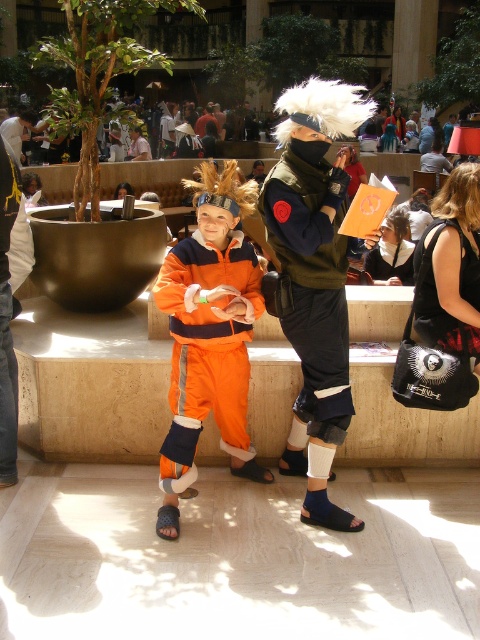
Does matte black vest at center appear on the right side of matte black mask at upper center?

Incorrect, matte black vest at center is not on the right side of matte black mask at upper center.

Is point (276, 225) closer to viewer compared to point (381, 138)?

Yes, it is in front of point (381, 138).

Locate an element on the screen. matte black vest at center is located at coordinates (314, 276).

Is matte black vest at center to the left of dark red fabric shirt at center from the viewer's perspective?

No, matte black vest at center is not to the left of dark red fabric shirt at center.

Does matte black vest at center lie in front of dark red fabric shirt at center?

Yes, matte black vest at center is in front of dark red fabric shirt at center.

Is point (305, 132) farther from camera compared to point (202, 131)?

No, it is in front of (202, 131).

You are a GUI agent. You are given a task and a screenshot of the screen. Output one action in this format:
    pyautogui.click(x=<x>, y=<y>)
    Task: Click on the matte black vest at center
    This screenshot has height=640, width=480.
    Given the screenshot: What is the action you would take?
    pyautogui.click(x=314, y=276)

Locate an element on the screen. This screenshot has height=640, width=480. matte black vest at center is located at coordinates (314, 276).

Does matte black vest at center have a smaller size compared to orange fabric pants at center?

Indeed, matte black vest at center has a smaller size compared to orange fabric pants at center.

What do you see at coordinates (314, 276) in the screenshot? I see `matte black vest at center` at bounding box center [314, 276].

Where is `matte black vest at center`? matte black vest at center is located at coordinates (314, 276).